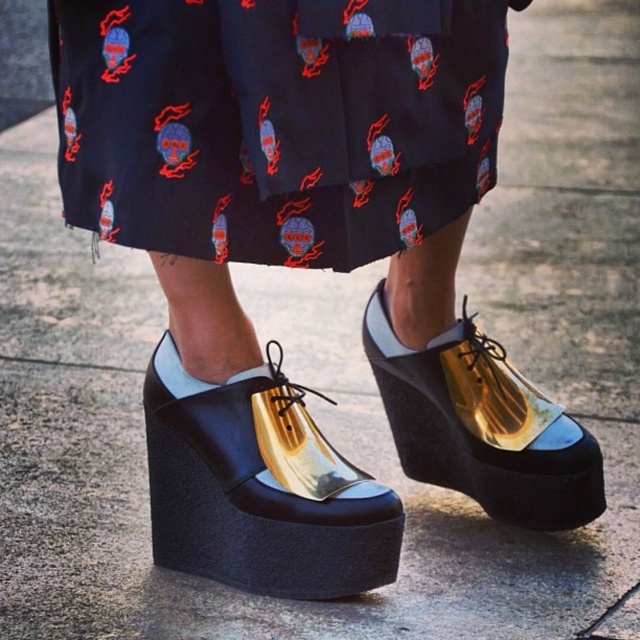
Between black cotton skirt at center and gold shiny platform shoe at center, which one has more height?

gold shiny platform shoe at center

Is point (412, 164) positioned in front of point (332, 522)?

Yes, point (412, 164) is in front of point (332, 522).

At what (x,y) coordinates should I click in order to perform the action: click on black cotton skirt at center. Please return your answer as a coordinate pair (x, y). The image size is (640, 640). Looking at the image, I should click on (275, 122).

Between gold shiny platform shoe at center and gold reflective platform shoe at center, which one has more height?

Standing taller between the two is gold reflective platform shoe at center.

Locate an element on the screen. The width and height of the screenshot is (640, 640). gold shiny platform shoe at center is located at coordinates (259, 486).

The height and width of the screenshot is (640, 640). I want to click on gold shiny platform shoe at center, so click(x=259, y=486).

Does black cotton skirt at center lie behind gold reflective platform shoe at center?

That is False.

This screenshot has height=640, width=640. What do you see at coordinates (275, 122) in the screenshot?
I see `black cotton skirt at center` at bounding box center [275, 122].

Where is `black cotton skirt at center`? Image resolution: width=640 pixels, height=640 pixels. black cotton skirt at center is located at coordinates (275, 122).